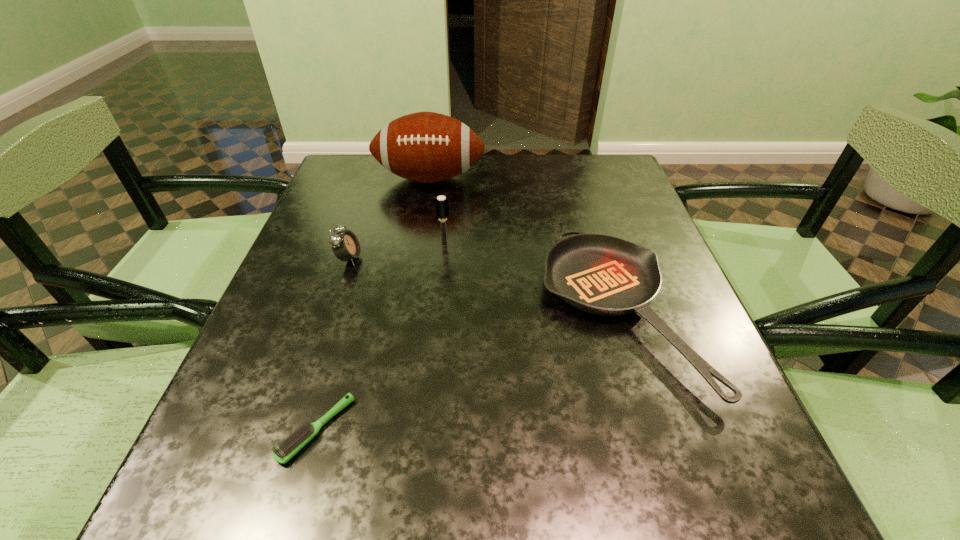
I want to click on vacant space that satisfies the following two spatial constraints: 1. on the face of the alarm clock; 2. on the back side of the fourth tallest object, so click(331, 313).

At what (x,y) coordinates should I click in order to perform the action: click on vacant space that satisfies the following two spatial constraints: 1. on the front side of the frying pan; 2. on the left side of the farther hairbrush. Please return your answer as a coordinate pair (x, y). The image size is (960, 540). Looking at the image, I should click on (439, 313).

Locate an element on the screen. vacant area in the image that satisfies the following two spatial constraints: 1. on the face of the fourth tallest object; 2. on the right side of the third tallest object is located at coordinates (331, 313).

This screenshot has width=960, height=540. Find the location of `vacant space that satisfies the following two spatial constraints: 1. on the laces of the football; 2. on the left side of the frying pan`. vacant space that satisfies the following two spatial constraints: 1. on the laces of the football; 2. on the left side of the frying pan is located at coordinates (408, 313).

Where is `blank space that satisfies the following two spatial constraints: 1. on the face of the alarm clock; 2. on the right side of the fourth tallest object`? Image resolution: width=960 pixels, height=540 pixels. blank space that satisfies the following two spatial constraints: 1. on the face of the alarm clock; 2. on the right side of the fourth tallest object is located at coordinates pyautogui.click(x=331, y=313).

This screenshot has height=540, width=960. Find the location of `free space in the image that satisfies the following two spatial constraints: 1. on the back side of the shortest object; 2. on the left side of the fourth tallest object`. free space in the image that satisfies the following two spatial constraints: 1. on the back side of the shortest object; 2. on the left side of the fourth tallest object is located at coordinates (350, 313).

At what (x,y) coordinates should I click in order to perform the action: click on vacant space that satisfies the following two spatial constraints: 1. on the laces of the farthest object; 2. on the face of the third shortest object. Please return your answer as a coordinate pair (x, y). Looking at the image, I should click on (417, 258).

The height and width of the screenshot is (540, 960). In order to click on free space in the image that satisfies the following two spatial constraints: 1. on the laces of the football; 2. on the face of the alarm clock in this screenshot , I will do `click(417, 258)`.